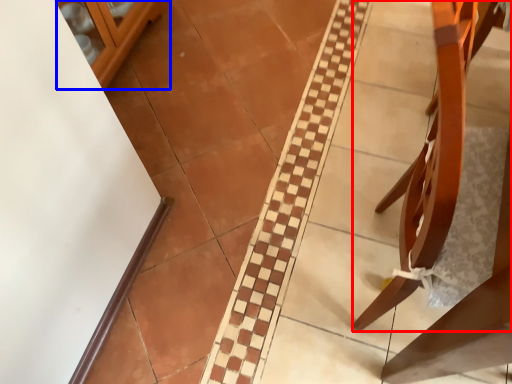
Question: Among these objects, which one is nearest to the camera, furniture (highlighted by a red box) or glass door (highlighted by a blue box)?

Choices:
 (A) furniture
 (B) glass door

Answer: (A)